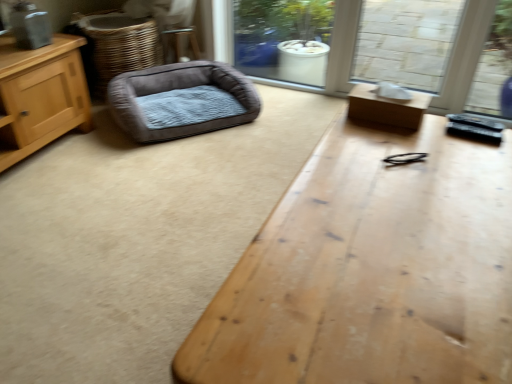
Where is `free space in front of velvet-like brown dog bed at left`? The height and width of the screenshot is (384, 512). free space in front of velvet-like brown dog bed at left is located at coordinates (156, 171).